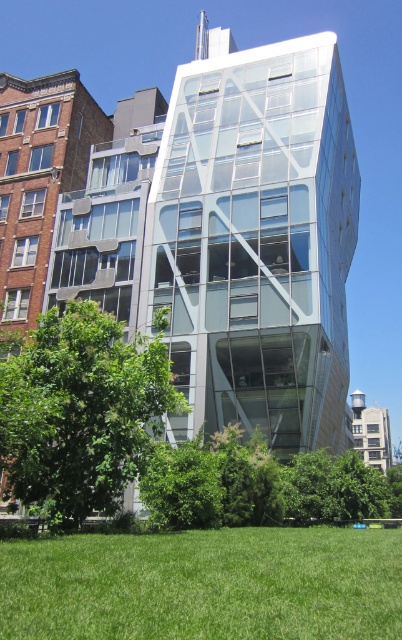
Which is more to the left, green leafy tree at lower left or green leafy tree at lower center?

Positioned to the left is green leafy tree at lower left.

Who is more distant from viewer, (26, 376) or (266, 448)?

Point (266, 448)

Which is behind, point (88, 314) or point (285, 476)?

The point (285, 476) is behind.

This screenshot has height=640, width=402. What are the coordinates of `green leafy tree at lower left` in the screenshot? It's located at (79, 412).

Who is more distant from viewer, (225, 582) or (139, 400)?

Point (139, 400)

Can you confirm if green grass at lower center is taller than green leafy tree at lower left?

Incorrect, green grass at lower center's height is not larger of green leafy tree at lower left's.

Is point (168, 561) closer to viewer compared to point (108, 369)?

Yes, point (168, 561) is closer to viewer.

You are a GUI agent. You are given a task and a screenshot of the screen. Output one action in this format:
    pyautogui.click(x=<x>, y=<y>)
    Task: Click on the green grass at lower center
    
    Given the screenshot: What is the action you would take?
    pyautogui.click(x=205, y=584)

Is green grass at lower center to the left of green leafy tree at lower center from the viewer's perspective?

Yes, green grass at lower center is to the left of green leafy tree at lower center.

Does green grass at lower center appear under green leafy tree at lower center?

Actually, green grass at lower center is above green leafy tree at lower center.

This screenshot has width=402, height=640. In order to click on green grass at lower center in this screenshot , I will do `click(205, 584)`.